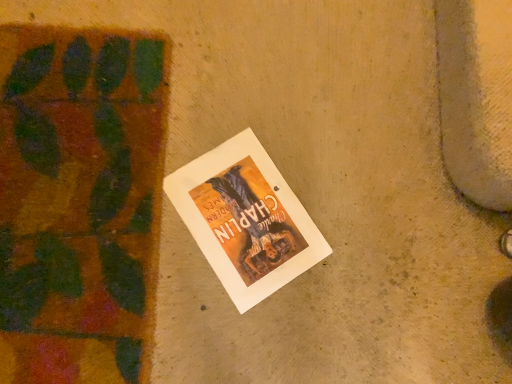
Question: Is point (287, 192) positioned closer to the camera than point (141, 67)?

Choices:
 (A) closer
 (B) farther

Answer: (A)

Question: Would you say white paper poster at center is to the left or to the right of green leafy plant at left in the picture?

Choices:
 (A) right
 (B) left

Answer: (A)

Question: Considering their positions, is white paper poster at center located in front of or behind green leafy plant at left?

Choices:
 (A) front
 (B) behind

Answer: (B)

Question: Considering the positions of green leafy plant at left and white paper poster at center in the image, is green leafy plant at left wider or thinner than white paper poster at center?

Choices:
 (A) thin
 (B) wide

Answer: (B)

Question: Considering their positions, is green leafy plant at left located in front of or behind white paper poster at center?

Choices:
 (A) front
 (B) behind

Answer: (A)

Question: Considering the positions of green leafy plant at left and white paper poster at center in the image, is green leafy plant at left bigger or smaller than white paper poster at center?

Choices:
 (A) big
 (B) small

Answer: (A)

Question: From the image's perspective, is green leafy plant at left located above or below white paper poster at center?

Choices:
 (A) above
 (B) below

Answer: (A)